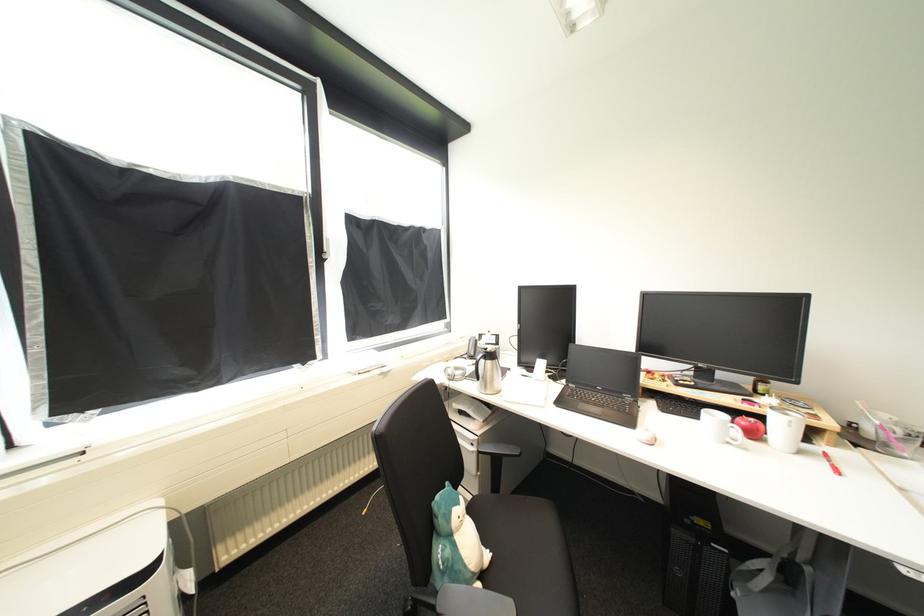
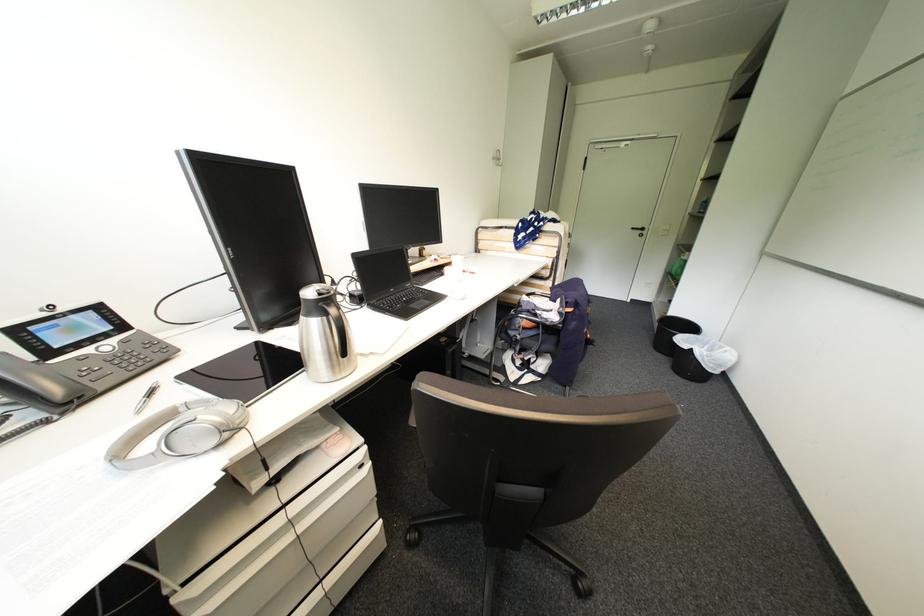
Question: I am providing you with two images of the same scene from different viewpoints. After the viewpoint changes to image2, which objects are now occluded?

Choices:
 (A) chair sitting surface
 (B) thermos handle
 (C) black trash can
 (D) orange bicycle grip

Answer: (A)